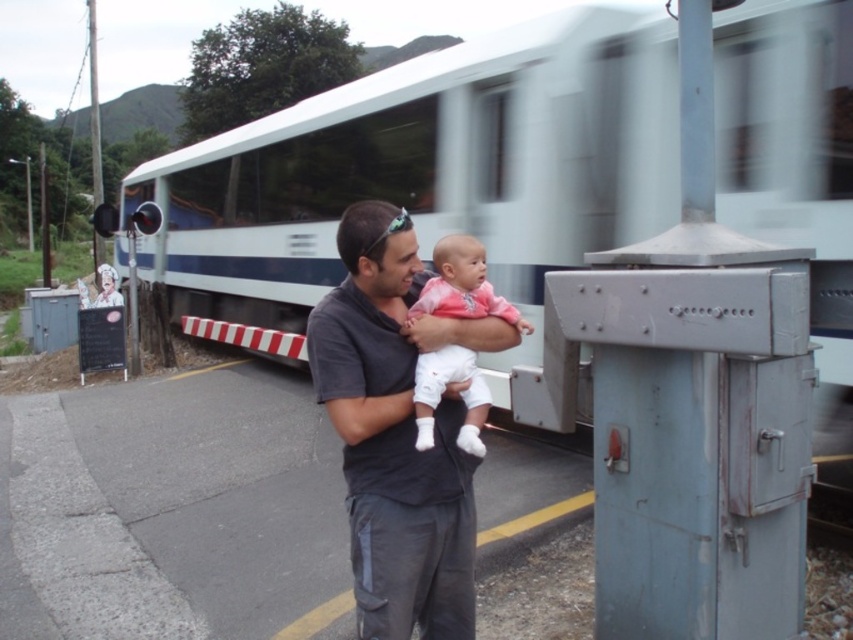
Question: Which point is farther to the camera?

Choices:
 (A) (428, 356)
 (B) (175, 193)
 (C) (378, 547)

Answer: (B)

Question: Does white glossy train at center appear on the left side of pink fabric baby at center?

Choices:
 (A) yes
 (B) no

Answer: (A)

Question: From the image, what is the correct spatial relationship of white glossy train at center in relation to pink fabric baby at center?

Choices:
 (A) above
 (B) below

Answer: (A)

Question: Is white glossy train at center thinner than dark gray shirt at center?

Choices:
 (A) no
 (B) yes

Answer: (A)

Question: Which point is closer to the camera?

Choices:
 (A) (x=460, y=280)
 (B) (x=368, y=337)
 (C) (x=346, y=116)

Answer: (B)

Question: Which of the following is the closest to the observer?

Choices:
 (A) (448, 262)
 (B) (389, 275)
 (C) (842, 241)

Answer: (B)